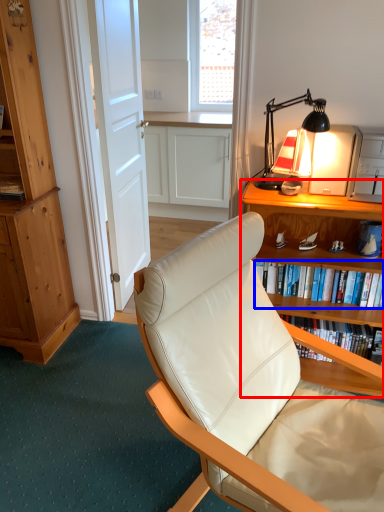
Question: Which object appears closest to the camera in this image, desk (highlighted by a red box) or book (highlighted by a blue box)?

Choices:
 (A) desk
 (B) book

Answer: (A)